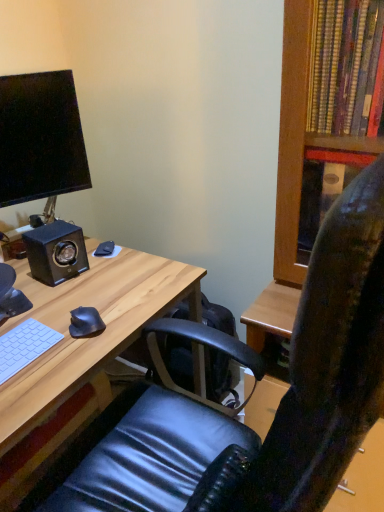
Locate an element on the screen. free space above light wood desk at center (from a real-world perspective) is located at coordinates (64, 300).